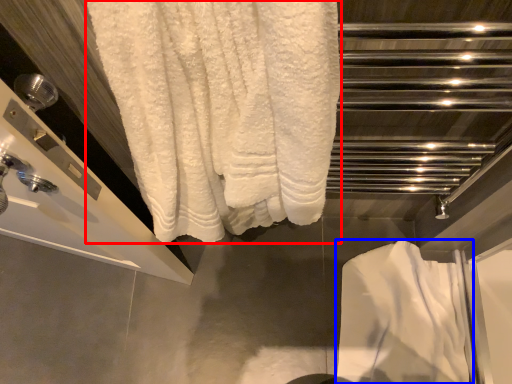
Question: Among these objects, which one is nearest to the camera, towel (highlighted by a red box) or bath towel (highlighted by a blue box)?

Choices:
 (A) towel
 (B) bath towel

Answer: (A)